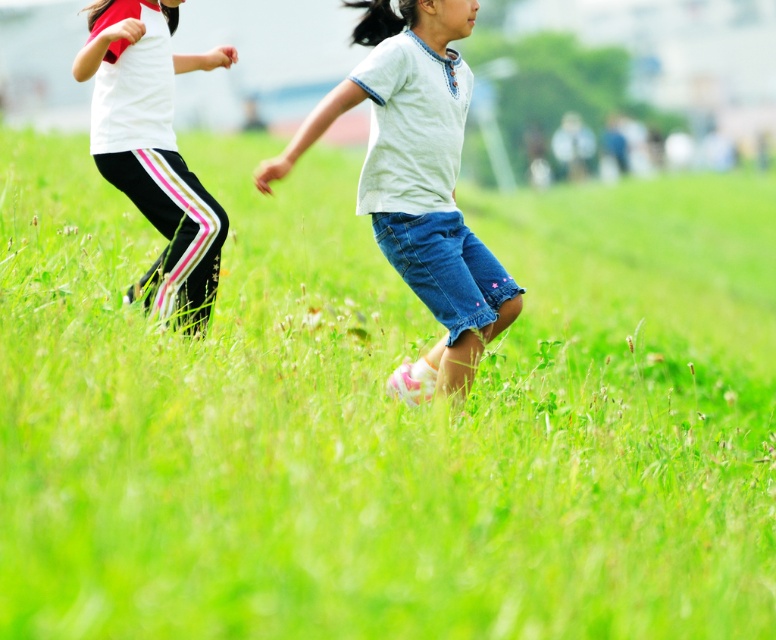
You are a photographer capturing the scene of two children playing in the grass. You notice the white cotton shirt at center and the white matte pants at left. Which item is closer to the camera?

The white cotton shirt at center is closer to the camera because it is in front of the white matte pants at left.

Based on the scene description, what object is located at the coordinates point (x=418, y=180)?

The point (x=418, y=180) corresponds to the white cotton shirt at center.